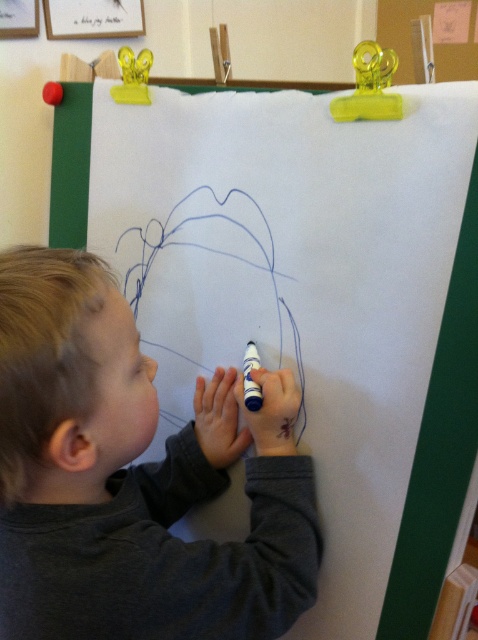
Which is below, dark gray sweater at lower left or blue matte marker at lower center?

Positioned lower is dark gray sweater at lower left.

Is dark gray sweater at lower left thinner than blue matte marker at lower center?

No, dark gray sweater at lower left is not thinner than blue matte marker at lower center.

Which is in front, point (77, 275) or point (249, 378)?

Point (77, 275)

Locate an element on the screen. The height and width of the screenshot is (640, 478). dark gray sweater at lower left is located at coordinates (133, 476).